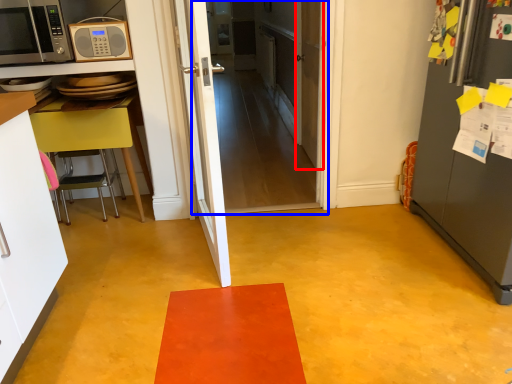
Question: Which object is further to the camera taking this photo, door (highlighted by a red box) or door (highlighted by a blue box)?

Choices:
 (A) door
 (B) door

Answer: (A)